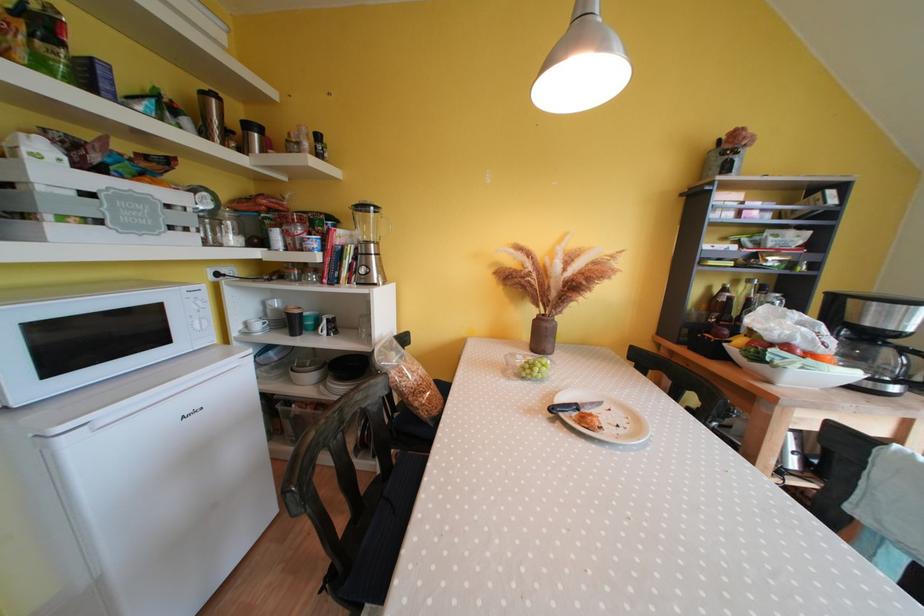
Where would you pull the refrigerator door handle? Please return your answer as a coordinate pair (x, y).

(162, 397)